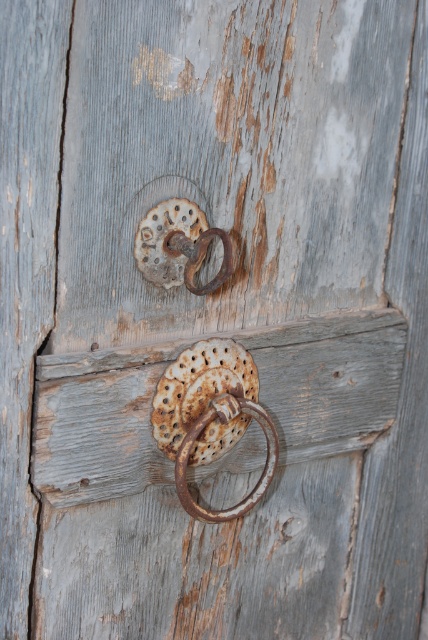
Question: Observing the image, what is the correct spatial positioning of rusty metal door handle at center in reference to rusty metal ring at center?

Choices:
 (A) right
 (B) left

Answer: (A)

Question: Which object appears farthest from the camera in this image?

Choices:
 (A) rusty metal door handle at center
 (B) rusty metal ring at center

Answer: (A)

Question: From the image, what is the correct spatial relationship of rusty metal door handle at center in relation to rusty metal ring at center?

Choices:
 (A) above
 (B) below

Answer: (B)

Question: Which of the following is the closest to the observer?

Choices:
 (A) rusty metal door handle at center
 (B) rusty metal ring at center

Answer: (B)

Question: Is rusty metal door handle at center further to the viewer compared to rusty metal ring at center?

Choices:
 (A) yes
 (B) no

Answer: (A)

Question: Which point is farther to the camera?

Choices:
 (A) (202, 381)
 (B) (187, 259)

Answer: (B)